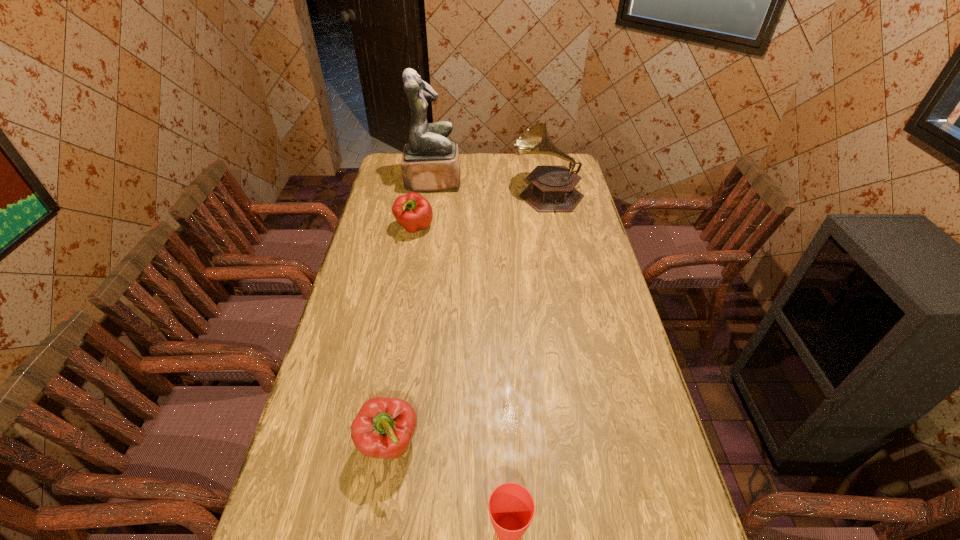
You are a GUI agent. You are given a task and a screenshot of the screen. Output one action in this format:
    pyautogui.click(x=<x>, y=<y>)
    Task: Click on the sculpture
    
    Given the screenshot: What is the action you would take?
    pyautogui.click(x=430, y=162)

I want to click on the second tallest object, so click(x=551, y=189).

The image size is (960, 540). In order to click on phonograph record in this screenshot , I will do `click(551, 189)`.

Locate an element on the screen. The image size is (960, 540). the second nearest object is located at coordinates (384, 427).

This screenshot has height=540, width=960. Identify the location of the farther bell pepper. [412, 211].

Locate an element on the screen. The width and height of the screenshot is (960, 540). vacant space situated 0.220m in a relaxed pose on the sculpture is located at coordinates (508, 181).

Find the location of a particular element. free space located on the horn direction of the phonograph record is located at coordinates (457, 194).

Find the location of a particular element. The image size is (960, 540). free space located on the horn direction of the phonograph record is located at coordinates point(482,194).

At what (x,y) coordinates should I click in order to perform the action: click on vacant space located 0.140m on the horn direction of the phonograph record. Please return your answer as a coordinate pair (x, y). The width and height of the screenshot is (960, 540). Looking at the image, I should click on (479, 194).

Where is `free point located on the front of the fourth farthest object`? The image size is (960, 540). free point located on the front of the fourth farthest object is located at coordinates (377, 523).